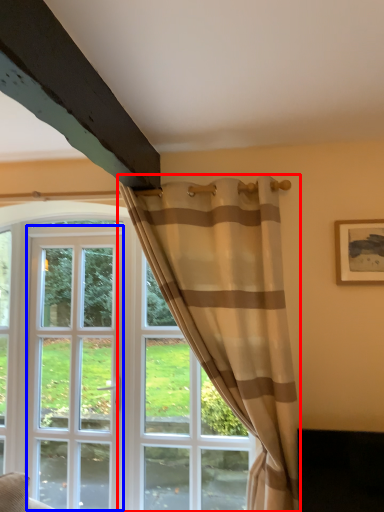
Question: Which point is closer to the camera, curtain (highlighted by a red box) or screen door (highlighted by a blue box)?

Choices:
 (A) curtain
 (B) screen door

Answer: (A)